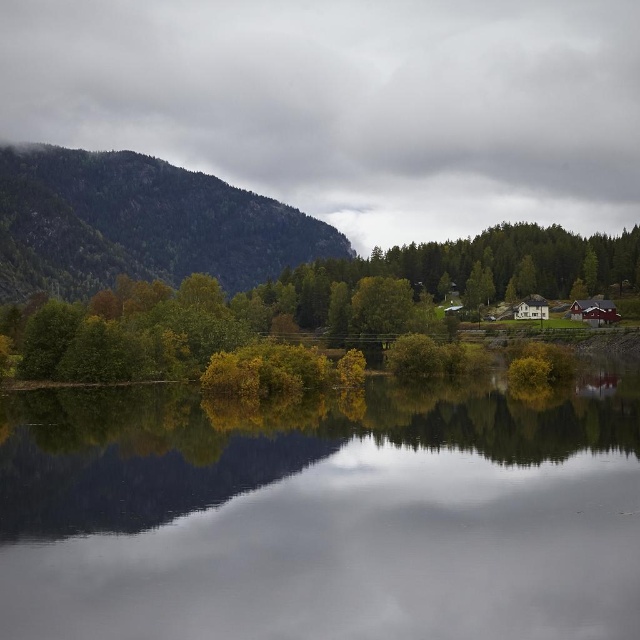
Between point (100, 413) and point (113, 225), which one is positioned in front?

Point (100, 413) is in front.

Between transparent water at center and green textured mountain at left, which one appears on the left side from the viewer's perspective?

Positioned to the left is green textured mountain at left.

Is point (243, 508) less distant than point (116, 259)?

Yes, point (243, 508) is in front of point (116, 259).

Identify the location of transparent water at center. (321, 516).

Does transparent water at center have a greater width compared to green leafy trees at center?

Incorrect, transparent water at center's width does not surpass green leafy trees at center's.

Does transparent water at center have a smaller size compared to green leafy trees at center?

Correct, transparent water at center occupies less space than green leafy trees at center.

This screenshot has width=640, height=640. Describe the element at coordinates (321, 516) in the screenshot. I see `transparent water at center` at that location.

Locate an element on the screen. transparent water at center is located at coordinates (321, 516).

The width and height of the screenshot is (640, 640). I want to click on green leafy trees at center, so click(310, 301).

Can you confirm if green leafy trees at center is shorter than green textured mountain at left?

Yes, green leafy trees at center is shorter than green textured mountain at left.

This screenshot has width=640, height=640. What do you see at coordinates (310, 301) in the screenshot? I see `green leafy trees at center` at bounding box center [310, 301].

The image size is (640, 640). I want to click on green leafy trees at center, so click(310, 301).